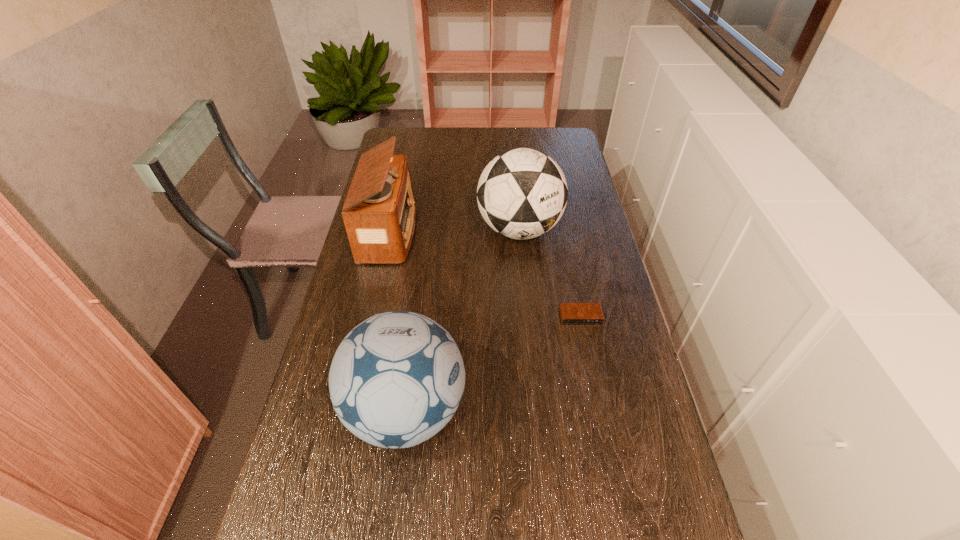
Locate an element on the screen. soccer ball situated at the left edge is located at coordinates (397, 378).

Locate an element on the screen. This screenshot has width=960, height=540. radio receiver that is at the left edge is located at coordinates (379, 213).

The image size is (960, 540). Find the location of `soccer ball located in the right edge section of the desktop`. soccer ball located in the right edge section of the desktop is located at coordinates (522, 193).

This screenshot has height=540, width=960. Find the location of `alarm clock at the right edge`. alarm clock at the right edge is located at coordinates (570, 313).

The height and width of the screenshot is (540, 960). I want to click on vacant space at the far edge of the desktop, so click(x=447, y=140).

At what (x,y) coordinates should I click in order to perform the action: click on vacant region at the right edge of the desktop. Please return your answer as a coordinate pair (x, y). Image resolution: width=960 pixels, height=540 pixels. Looking at the image, I should click on (613, 374).

Locate an element on the screen. The image size is (960, 540). vacant space at the far left corner of the desktop is located at coordinates (413, 151).

Locate an element on the screen. free space at the far right corner of the desktop is located at coordinates (571, 140).

This screenshot has width=960, height=540. I want to click on unoccupied area between the alarm clock and the farther soccer ball, so click(x=550, y=273).

Locate an element on the screen. The width and height of the screenshot is (960, 540). empty space that is in between the radio receiver and the farther soccer ball is located at coordinates (454, 231).